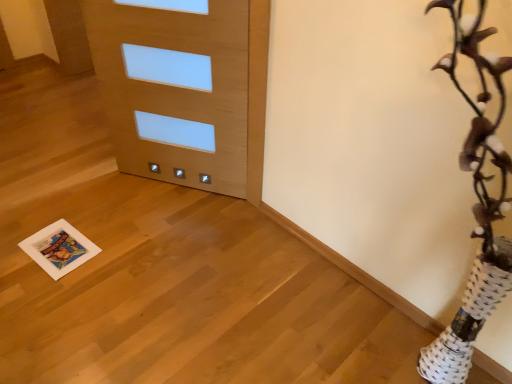
Locate an element on the screen. free space above white paper print at lower left (from a real-world perspective) is located at coordinates [x=59, y=248].